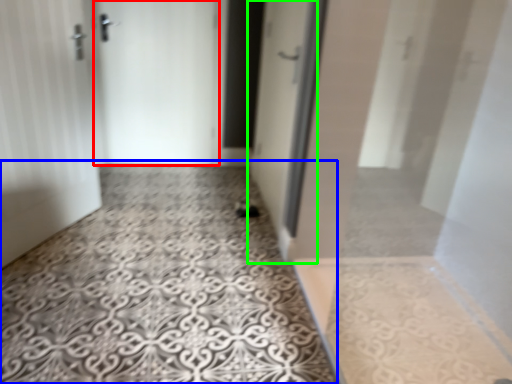
Question: Which object is positioned farthest from door (highlighted by a red box)? Select from concrete (highlighted by a blue box) and door (highlighted by a green box).

Choices:
 (A) concrete
 (B) door

Answer: (A)